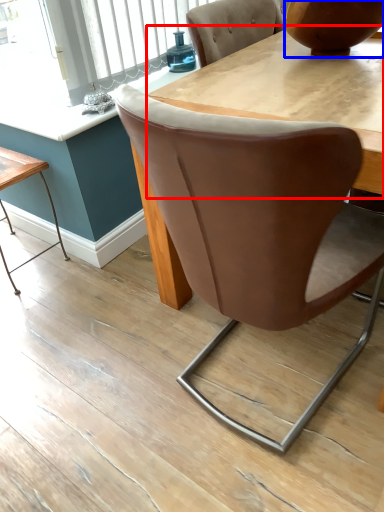
Question: Which point is closer to the camera, round table (highlighted by a red box) or vase (highlighted by a blue box)?

Choices:
 (A) round table
 (B) vase

Answer: (A)